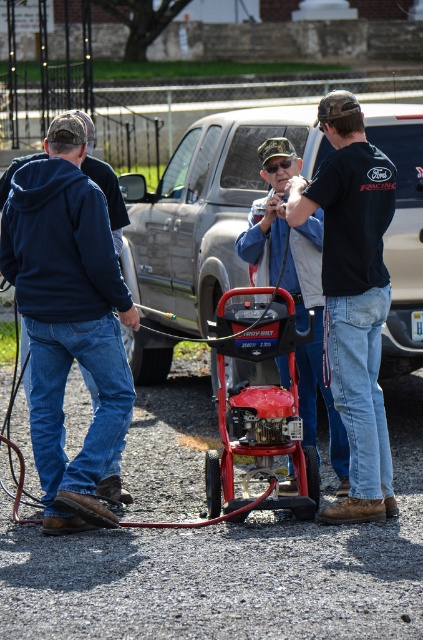
Question: Is the position of metallic silver truck at center more distant than that of dark blue hoodie at left?

Choices:
 (A) no
 (B) yes

Answer: (B)

Question: Observing the image, what is the correct spatial positioning of dark blue hoodie at left in reference to black cotton shirt at center?

Choices:
 (A) right
 (B) left

Answer: (B)

Question: Among these objects, which one is farthest from the camera?

Choices:
 (A) matte black jacket at center
 (B) dark blue hoodie at left

Answer: (A)

Question: Based on their relative distances, which object is nearer to the black cotton shirt at center?

Choices:
 (A) dark blue hoodie at left
 (B) matte black jacket at center

Answer: (B)

Question: Based on their relative distances, which object is farther from the black cotton shirt at center?

Choices:
 (A) metallic silver truck at center
 (B) dark blue hoodie at left

Answer: (A)

Question: Where is metallic silver truck at center located in relation to matte black jacket at center in the image?

Choices:
 (A) left
 (B) right

Answer: (A)